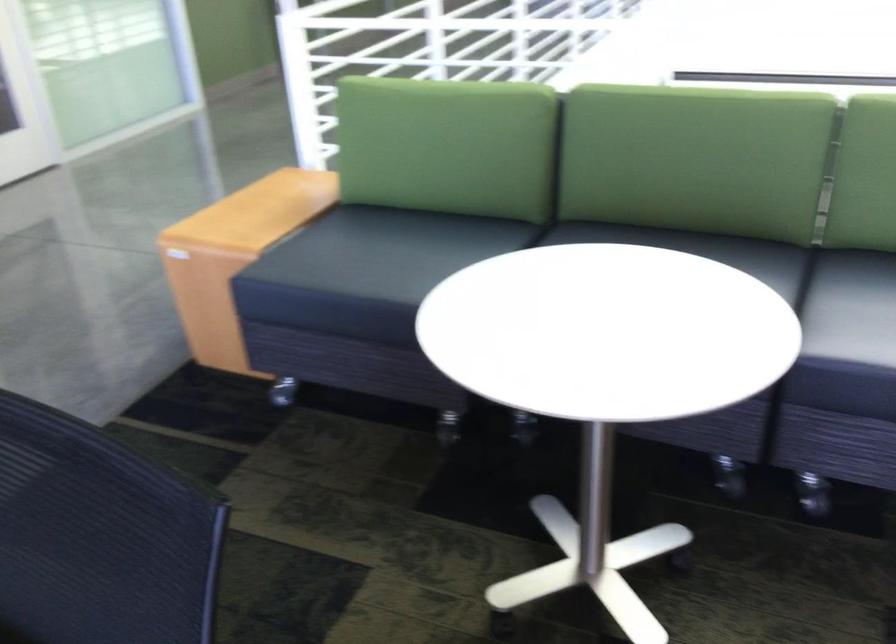
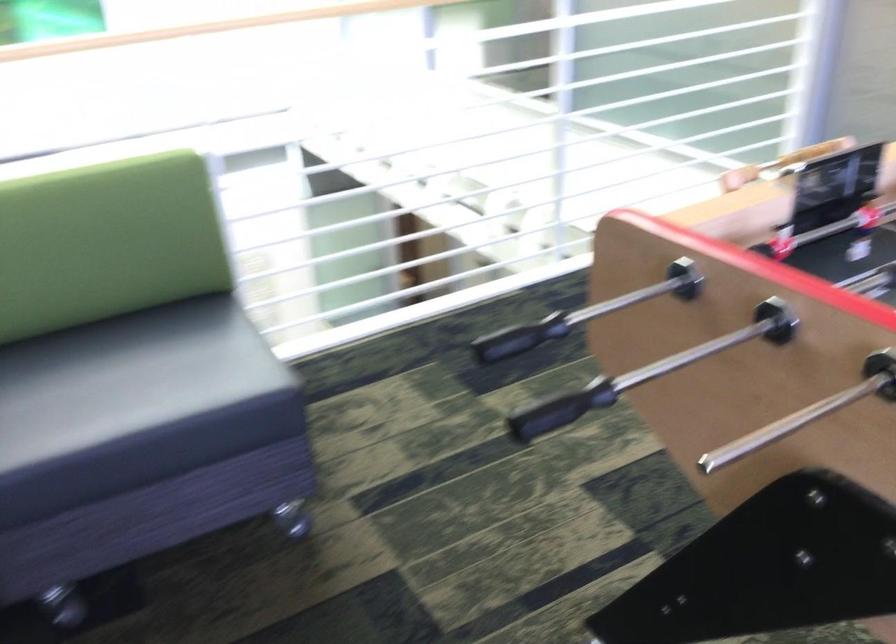
Question: How did the camera likely rotate?

Choices:
 (A) Left
 (B) Right
 (C) Up
 (D) Down

Answer: (B)